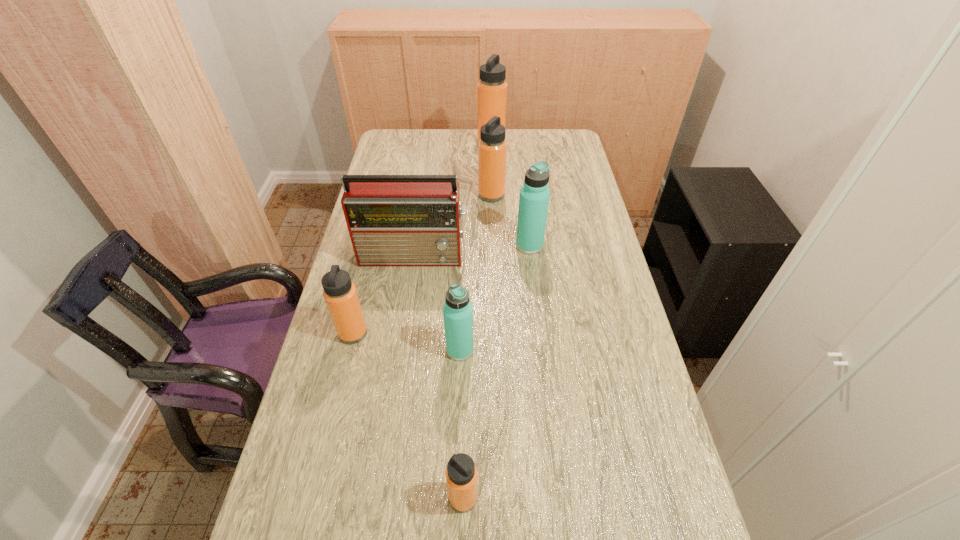
Where is `the farthest orange thermos bottle`? The height and width of the screenshot is (540, 960). the farthest orange thermos bottle is located at coordinates (492, 88).

The width and height of the screenshot is (960, 540). I want to click on the tallest object, so click(492, 88).

Image resolution: width=960 pixels, height=540 pixels. Find the location of `radio receiver`. radio receiver is located at coordinates (393, 220).

The image size is (960, 540). Find the location of `the second farthest object`. the second farthest object is located at coordinates 492,147.

The width and height of the screenshot is (960, 540). I want to click on the third smallest orange thermos bottle, so click(x=492, y=147).

Identify the location of the right aqua thermos bottle. (534, 196).

You are a GUI agent. You are given a task and a screenshot of the screen. Output one action in this format:
    pyautogui.click(x=<x>, y=<y>)
    Task: Click on the fourth nearest thermos bottle
    The height and width of the screenshot is (540, 960).
    Given the screenshot: What is the action you would take?
    pyautogui.click(x=534, y=196)

You are a GUI agent. You are given a task and a screenshot of the screen. Output one action in this format:
    pyautogui.click(x=<x>, y=<y>)
    Task: Click on the left aqua thermos bottle
    The image size is (960, 540).
    Given the screenshot: What is the action you would take?
    pyautogui.click(x=457, y=311)

Image resolution: width=960 pixels, height=540 pixels. I want to click on the nearer aqua thermos bottle, so click(457, 311).

Locate an element on the screen. Image resolution: width=960 pixels, height=540 pixels. the second smallest orange thermos bottle is located at coordinates (x=340, y=294).